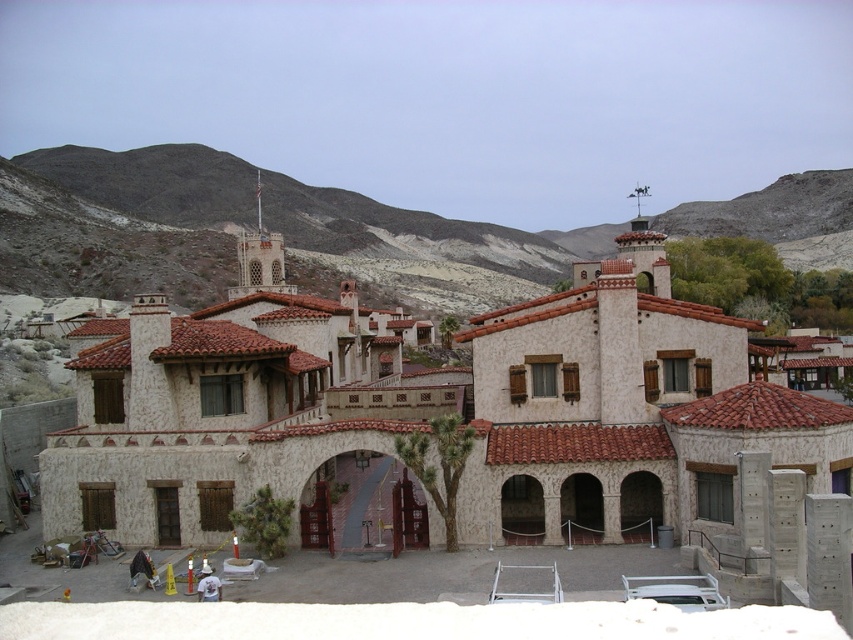
Between white stucco building at center and gray rocky mountain at upper center, which one has less height?

white stucco building at center is shorter.

Who is more distant from viewer, (692, 449) or (10, 252)?

The point (10, 252) is more distant.

What do you see at coordinates (434, 412) in the screenshot? I see `white stucco building at center` at bounding box center [434, 412].

Find the location of `white stucco building at center`. white stucco building at center is located at coordinates (434, 412).